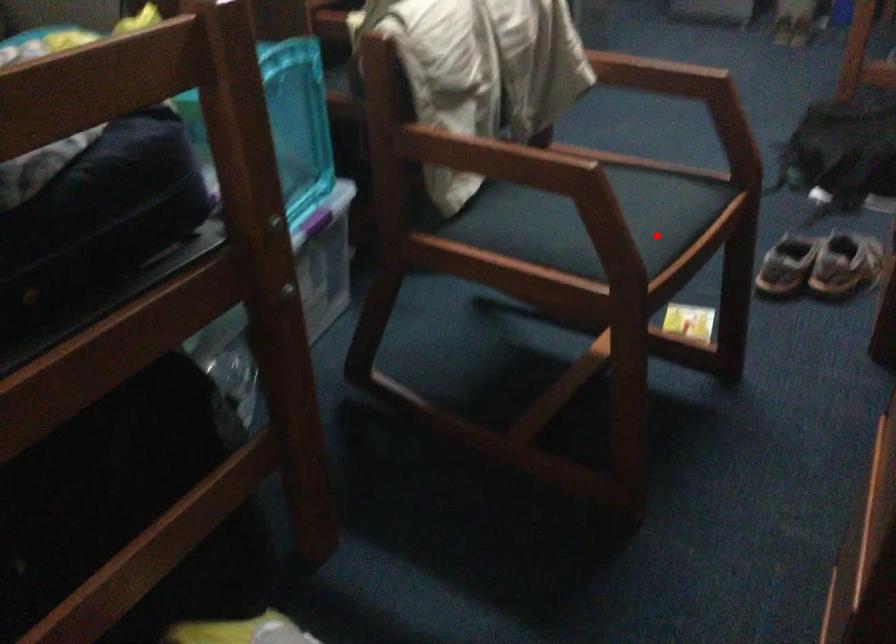
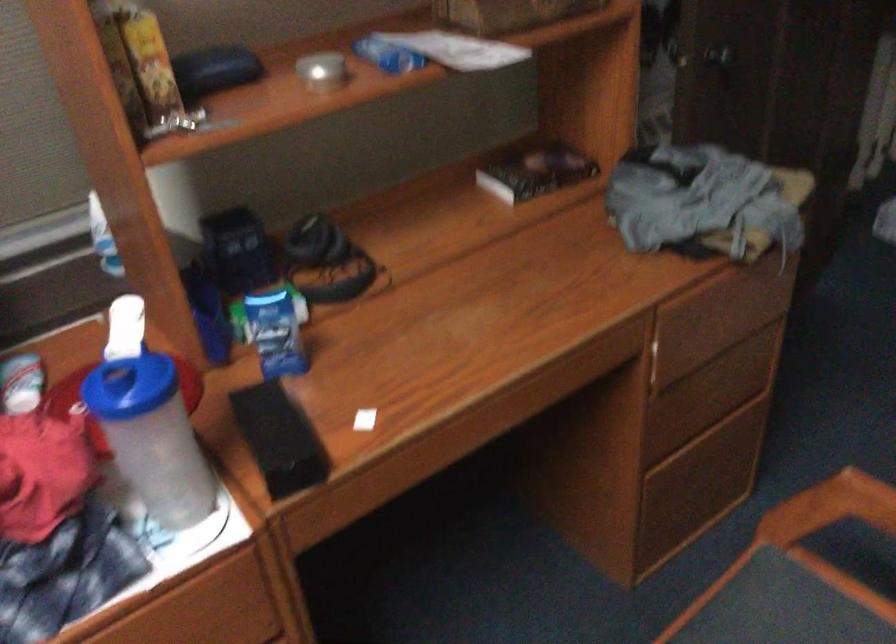
Question: I am providing you with two images of the same scene from different viewpoints. A red point is shown in image1. For the corresponding object point in image2, is it positioned nearer or farther from the camera?

Choices:
 (A) Nearer
 (B) Farther

Answer: (A)